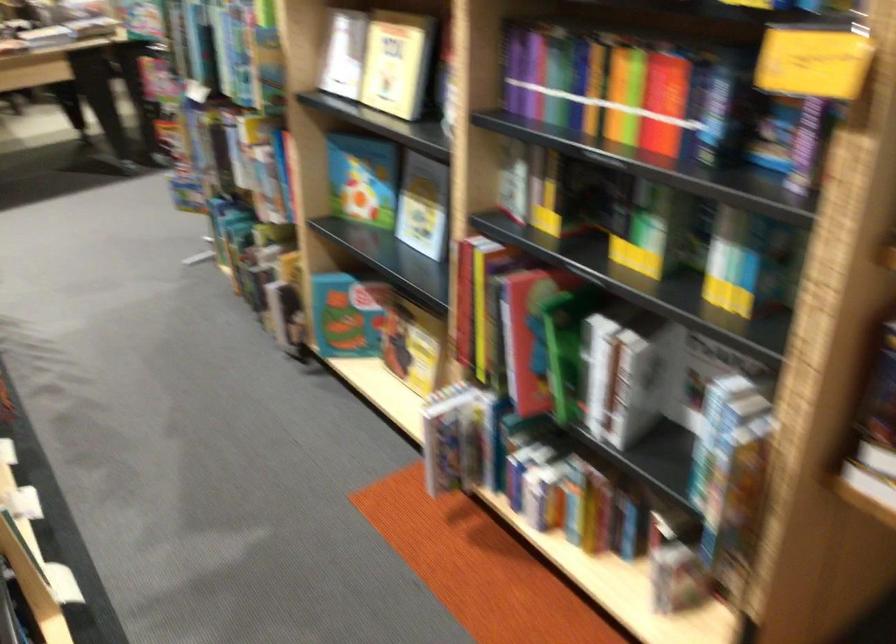
In order to click on red covered book in this screenshot , I will do `click(523, 337)`.